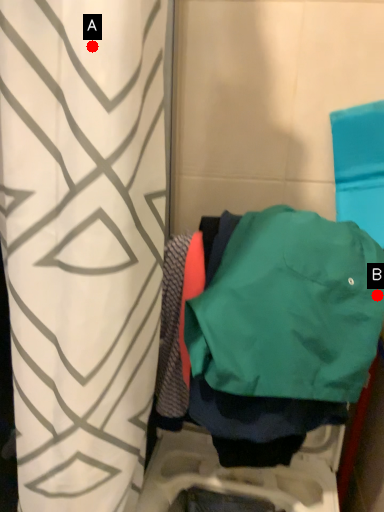
Question: Two points are circled on the image, labeled by A and B beside each circle. Among these points, which one is farthest from the camera?

Choices:
 (A) A is further
 (B) B is further

Answer: (B)